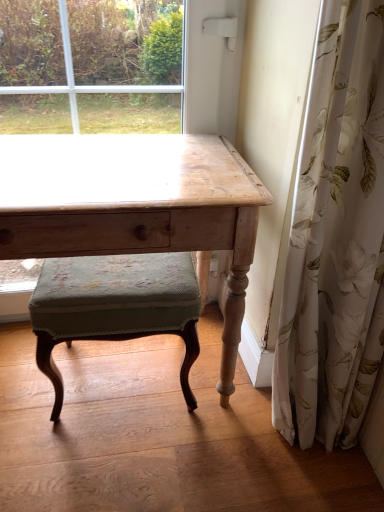
What is the approximate width of wooden table at center?

The width of wooden table at center is 21.26 inches.

Locate an element on the screen. This screenshot has height=512, width=384. wooden desk at center is located at coordinates (108, 73).

The image size is (384, 512). What are the coordinates of `wooden table at center` in the screenshot? It's located at (134, 206).

From the image's perspective, which is above, white floral fabric at right or wooden desk at center?

wooden desk at center.

Which of these two, white floral fabric at right or wooden desk at center, is wider?

With larger width is white floral fabric at right.

How different are the orientations of white floral fabric at right and wooden desk at center in degrees?

0.00402 degrees separate the facing orientations of white floral fabric at right and wooden desk at center.

From the image's perspective, is white floral fabric at right positioned above or below wooden table at center?

From the image's perspective, white floral fabric at right appears above wooden table at center.

Is white floral fabric at right oriented towards wooden table at center?

No, white floral fabric at right is not facing towards wooden table at center.

Based on their sizes in the image, would you say white floral fabric at right is bigger or smaller than wooden table at center?

white floral fabric at right is smaller than wooden table at center.

From a real-world perspective, which is physically below, wooden desk at center or white floral fabric at right?

From a 3D spatial view, wooden desk at center is below.

Consider the image. Could you tell me if wooden desk at center is facing white floral fabric at right?

Yes, wooden desk at center is oriented towards white floral fabric at right.

Considering the relative positions of wooden desk at center and white floral fabric at right in the image provided, is wooden desk at center to the left or to the right of white floral fabric at right?

wooden desk at center is positioned on white floral fabric at right's left side.

From the picture: Is white floral fabric at right thinner than velvet green cushioned stool at center?

Yes.

From a real-world perspective, does white floral fabric at right stand above velvet green cushioned stool at center?

Yes, from a real-world perspective, white floral fabric at right is over velvet green cushioned stool at center

The width and height of the screenshot is (384, 512). I want to click on stool located on the left of white floral fabric at right, so click(115, 306).

Where is `curtain above the velvet green cushioned stool at center (from a real-world perspective)`? Image resolution: width=384 pixels, height=512 pixels. curtain above the velvet green cushioned stool at center (from a real-world perspective) is located at coordinates (336, 239).

Consider the image. Could you tell me if velvet green cushioned stool at center is facing white floral fabric at right?

No, velvet green cushioned stool at center is not facing towards white floral fabric at right.

From a real-world perspective, between velvet green cushioned stool at center and white floral fabric at right, who is vertically lower?

velvet green cushioned stool at center.

Does point (184, 261) lie in front of point (357, 340)?

No, it is behind (357, 340).

From a real-world perspective, is velvet green cushioned stool at center positioned under wooden table at center based on gravity?

Correct, in the physical world, velvet green cushioned stool at center is lower than wooden table at center.

From the image's perspective, which object appears higher, velvet green cushioned stool at center or wooden table at center?

wooden table at center, from the image's perspective.

From the picture: Is velvet green cushioned stool at center not close to wooden table at center?

No, there isn't a large distance between velvet green cushioned stool at center and wooden table at center.

Which is in front, point (80, 273) or point (239, 303)?

Positioned in front is point (239, 303).

Between point (216, 201) and point (68, 298), which one is positioned behind?

The point (68, 298) is farther.

From the image's perspective, between wooden table at center and velvet green cushioned stool at center, who is located below?

velvet green cushioned stool at center is shown below in the image.

Is wooden table at center in front of or behind velvet green cushioned stool at center in the image?

In the image, wooden table at center appears in front of velvet green cushioned stool at center.

How far apart are wooden table at center and velvet green cushioned stool at center?

8.74 inches.

What are the coordinates of `bay window behind the white floral fabric at right` in the screenshot? It's located at click(x=108, y=73).

Locate an element on the screen. This screenshot has width=384, height=512. table directly beneath the white floral fabric at right (from a real-world perspective) is located at coordinates (134, 206).

Looking at the image, which one is located closer to wooden desk at center, velvet green cushioned stool at center or wooden table at center?

wooden table at center is positioned closer to the anchor wooden desk at center.

Which object lies further to the anchor point velvet green cushioned stool at center, wooden table at center or white floral fabric at right?

white floral fabric at right.

Considering their positions, is wooden table at center positioned further to wooden desk at center than velvet green cushioned stool at center?

velvet green cushioned stool at center lies further to wooden desk at center than the other object.

Which object lies further to the anchor point wooden table at center, white floral fabric at right or wooden desk at center?

The object further to wooden table at center is wooden desk at center.

Looking at the image, which one is located closer to wooden table at center, white floral fabric at right or velvet green cushioned stool at center?

Among the two, velvet green cushioned stool at center is located nearer to wooden table at center.

Considering their positions, is white floral fabric at right positioned closer to wooden desk at center than wooden table at center?

wooden table at center is closer to wooden desk at center.

Looking at the image, which one is located closer to wooden table at center, wooden desk at center or white floral fabric at right?

Based on the image, white floral fabric at right appears to be nearer to wooden table at center.

From the image, which object appears to be farther from white floral fabric at right, velvet green cushioned stool at center or wooden table at center?

Among the two, velvet green cushioned stool at center is located further to white floral fabric at right.

Where is `table located between wooden desk at center and white floral fabric at right in the left-right direction`? table located between wooden desk at center and white floral fabric at right in the left-right direction is located at coordinates (134, 206).

The height and width of the screenshot is (512, 384). I want to click on stool between wooden desk at center and white floral fabric at right, so click(x=115, y=306).

Identify the location of stool located between wooden table at center and white floral fabric at right in the left-right direction. The width and height of the screenshot is (384, 512). (115, 306).

Image resolution: width=384 pixels, height=512 pixels. In order to click on table between wooden desk at center and velvet green cushioned stool at center vertically in this screenshot , I will do `click(134, 206)`.